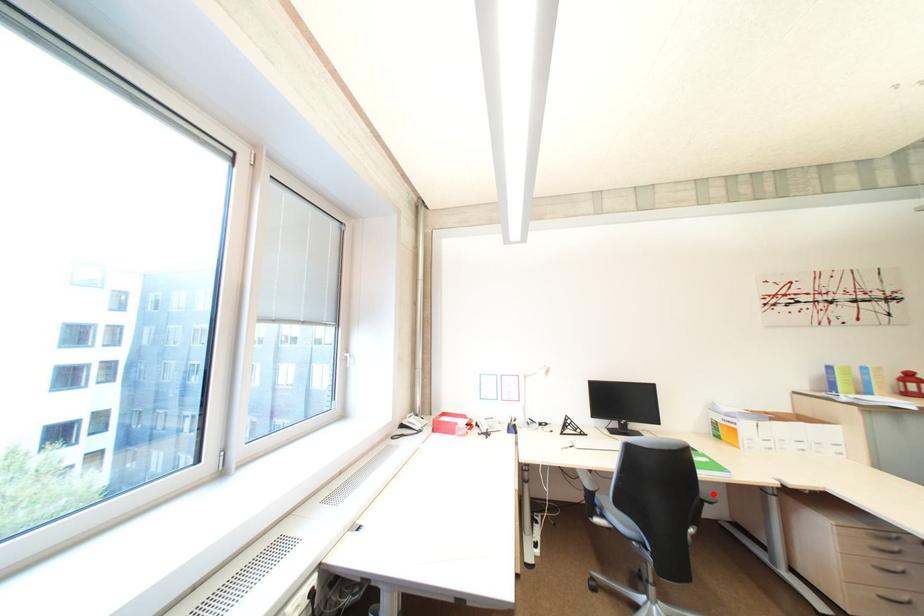
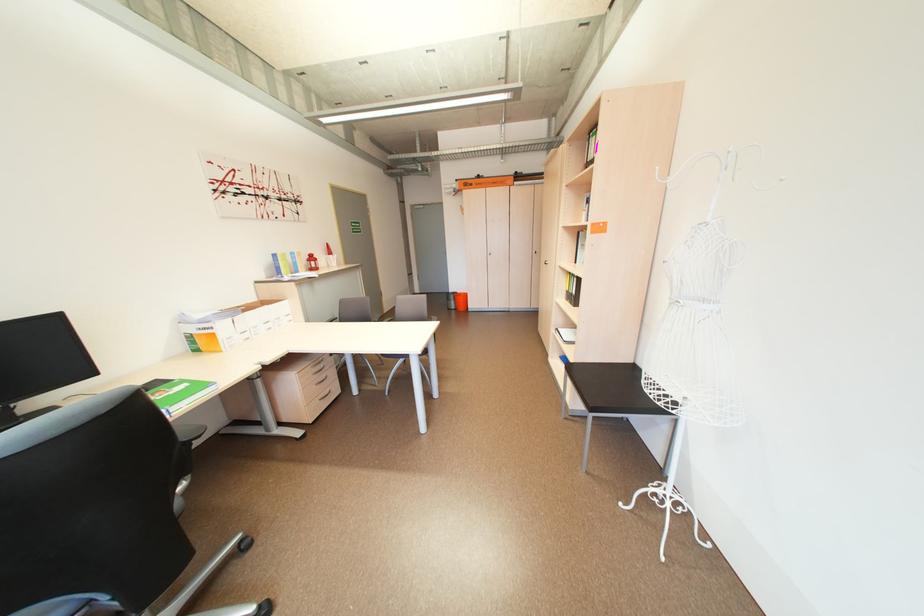
Question: I am providing you with two images of the same scene from different viewpoints. In image1, a red point is highlighted. Considering the same 3D point in image2, which of the following is correct?

Choices:
 (A) It is closer
 (B) It is farther

Answer: (A)